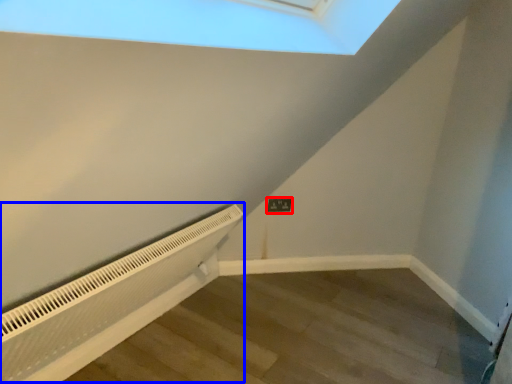
Question: Which point is closer to the camera, electric outlet (highlighted by a red box) or air conditioner (highlighted by a blue box)?

Choices:
 (A) electric outlet
 (B) air conditioner

Answer: (B)